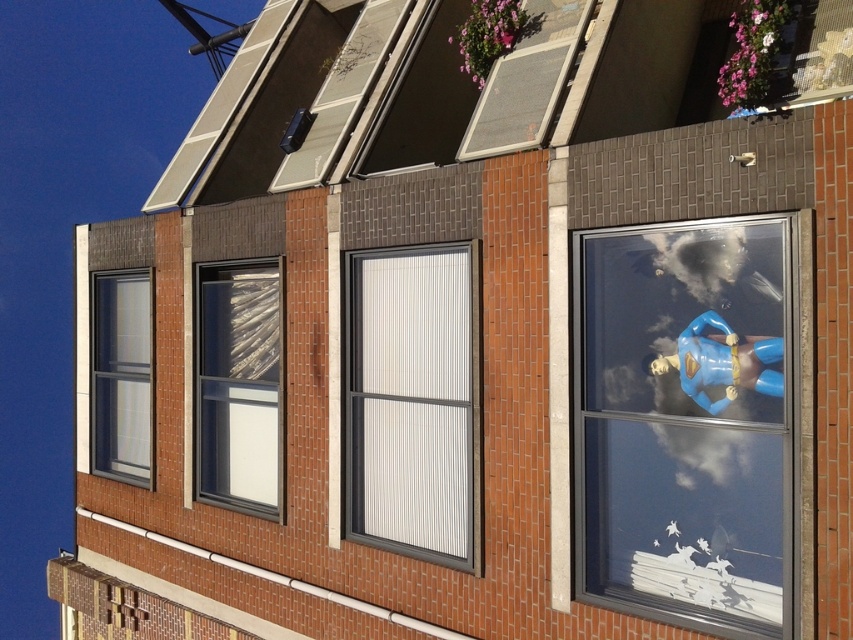
This screenshot has width=853, height=640. I want to click on clear glass window at upper left, so [120, 376].

Is point (105, 333) positioned before point (695, 372)?

That is False.

The height and width of the screenshot is (640, 853). Find the location of `clear glass window at upper left`. clear glass window at upper left is located at coordinates (120, 376).

At what (x,y) coordinates should I click in order to perform the action: click on clear glass window at upper left. Please return your answer as a coordinate pair (x, y). Looking at the image, I should click on (120, 376).

Is matte gray window at upper center to the right of blue plastic superman figure at right from the viewer's perspective?

No, matte gray window at upper center is not to the right of blue plastic superman figure at right.

Can you confirm if matte gray window at upper center is smaller than blue plastic superman figure at right?

No, matte gray window at upper center is not smaller than blue plastic superman figure at right.

Does point (440, 42) come in front of point (775, 394)?

No, (440, 42) is further to viewer.

Where is `matte gray window at upper center`? Image resolution: width=853 pixels, height=640 pixels. matte gray window at upper center is located at coordinates (479, 92).

Is white textured blinds at center closer to the viewer compared to matte gray window at upper center?

Yes, it is in front of matte gray window at upper center.

Who is shorter, white textured blinds at center or matte gray window at upper center?

Standing shorter between the two is matte gray window at upper center.

Which is in front, point (405, 365) or point (498, 97)?

Point (498, 97) is more forward.

Locate an element on the screen. The height and width of the screenshot is (640, 853). white textured blinds at center is located at coordinates (413, 401).